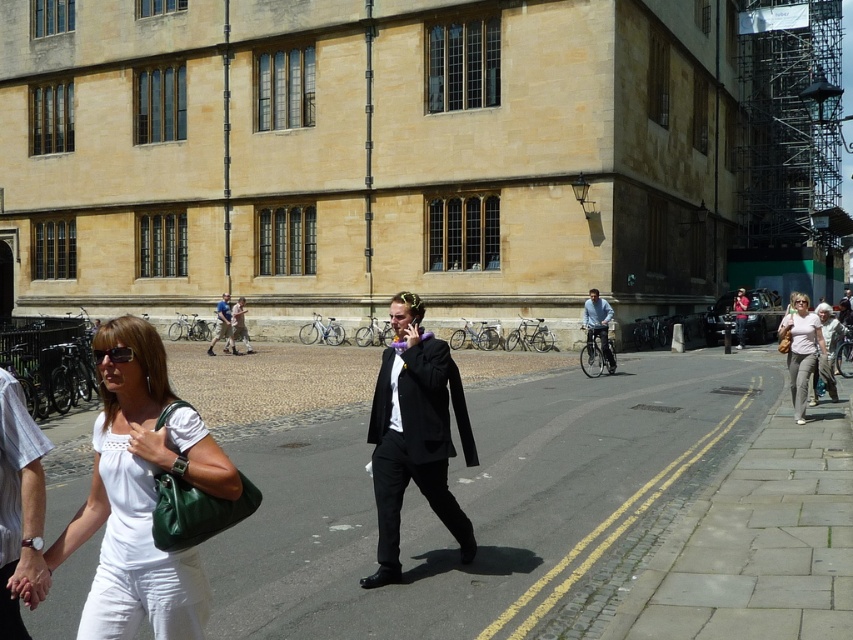
Does white fabric dress at left lie behind matte black suit at center?

No.

Between white fabric dress at left and matte black suit at center, which one has less height?

matte black suit at center is shorter.

Where is `white fabric dress at left`? The image size is (853, 640). white fabric dress at left is located at coordinates (141, 493).

This screenshot has width=853, height=640. In order to click on white fabric dress at left in this screenshot , I will do `click(141, 493)`.

What do you see at coordinates (138, 556) in the screenshot? Image resolution: width=853 pixels, height=640 pixels. I see `white cotton dress at lower left` at bounding box center [138, 556].

Can you confirm if white cotton dress at lower left is smaller than pink cotton shirt at center?

Yes, white cotton dress at lower left is smaller than pink cotton shirt at center.

Who is more forward, (154, 577) or (805, 296)?

Point (154, 577) is more forward.

I want to click on white cotton dress at lower left, so click(138, 556).

Who is more distant from viewer, (x=55, y=554) or (x=815, y=323)?

Point (x=815, y=323)

The image size is (853, 640). What do you see at coordinates (141, 493) in the screenshot?
I see `white fabric dress at left` at bounding box center [141, 493].

Which is behind, point (126, 608) or point (801, 371)?

The point (801, 371) is more distant.

Where is `white fabric dress at left`? This screenshot has width=853, height=640. white fabric dress at left is located at coordinates (141, 493).